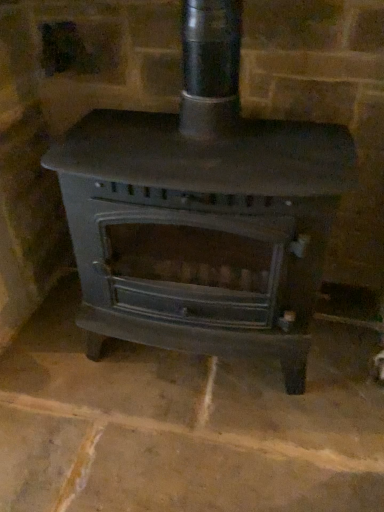
Where is `matte black wood burning stove at center`? matte black wood burning stove at center is located at coordinates (203, 212).

The image size is (384, 512). What do you see at coordinates (203, 212) in the screenshot?
I see `matte black wood burning stove at center` at bounding box center [203, 212].

The width and height of the screenshot is (384, 512). I want to click on matte black wood burning stove at center, so click(203, 212).